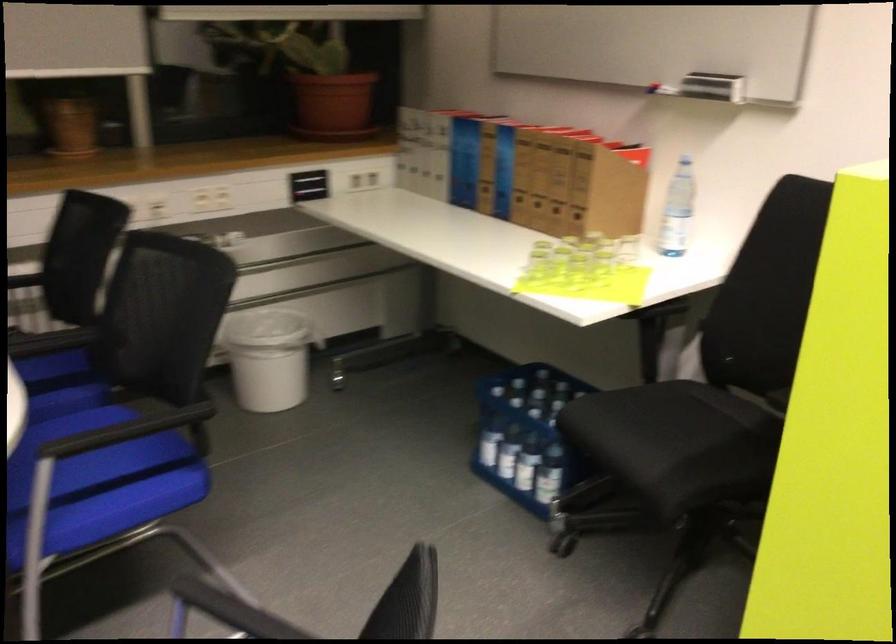
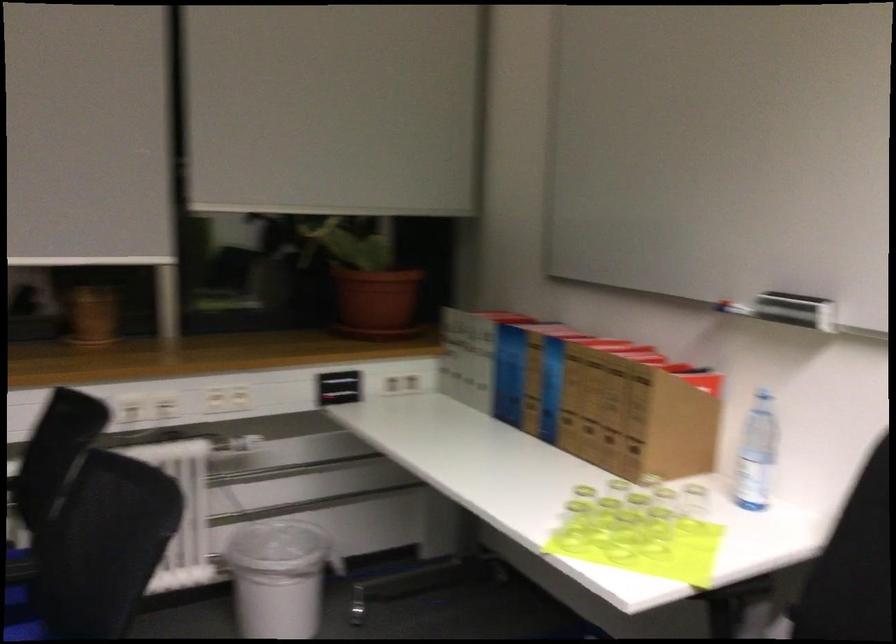
Where in the second image is the point corresponding to the point at 599,275 from the first image?

(655, 534)